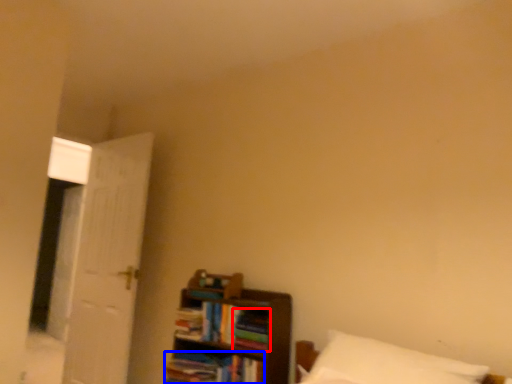
Question: Which object is closer to the camera taking this photo, book (highlighted by a red box) or book (highlighted by a blue box)?

Choices:
 (A) book
 (B) book

Answer: (B)